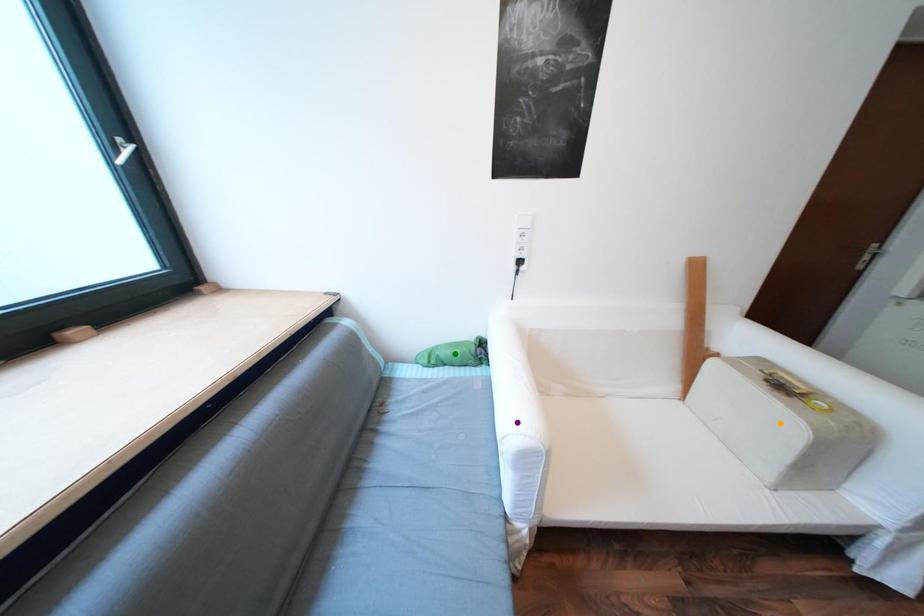
Order these from farthest to nearest:
orange point, purple point, green point

green point < purple point < orange point